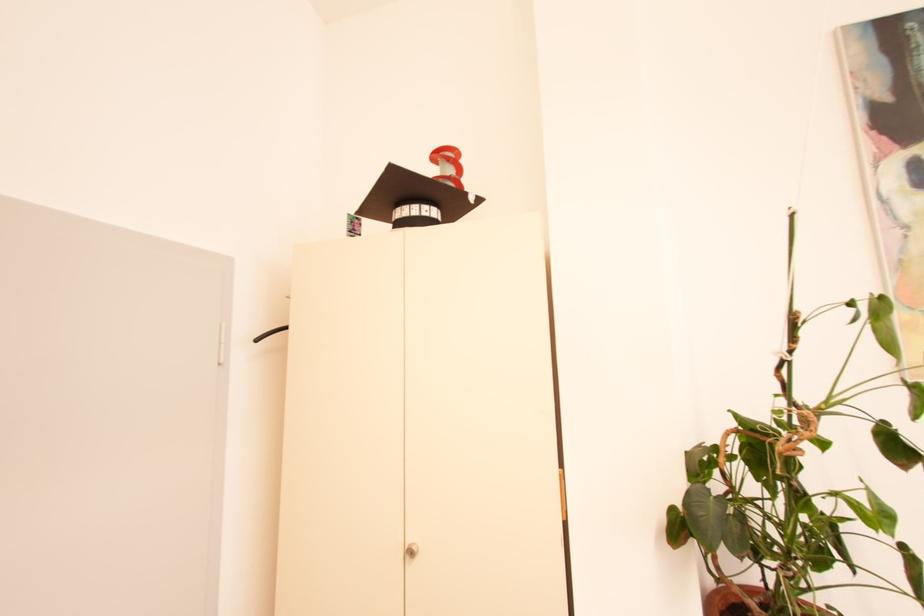
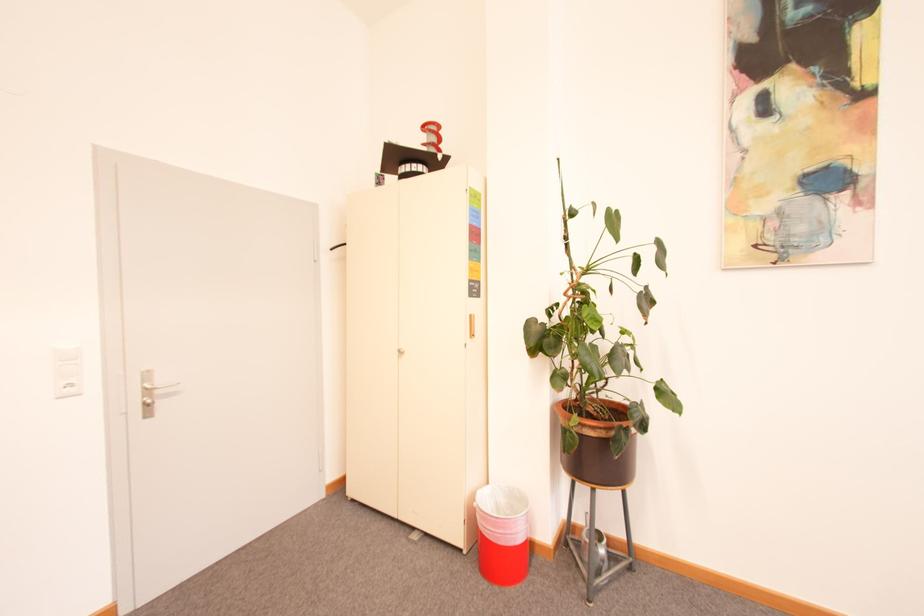
What movement of the cameraman would produce the second image?

The cameraman moved toward right, backward.